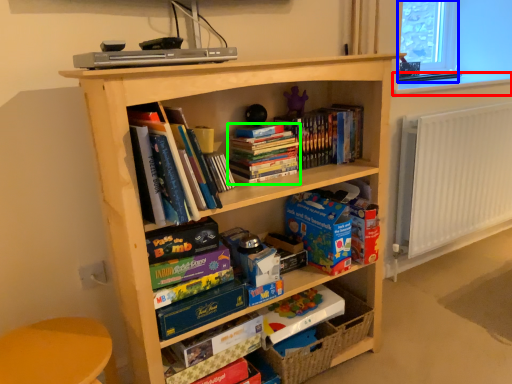
Question: Estimate the real-world distances between objects in this image. Which object is farther from window sill (highlighted by a red box), window screen (highlighted by a blue box) or book (highlighted by a green box)?

Choices:
 (A) window screen
 (B) book

Answer: (B)